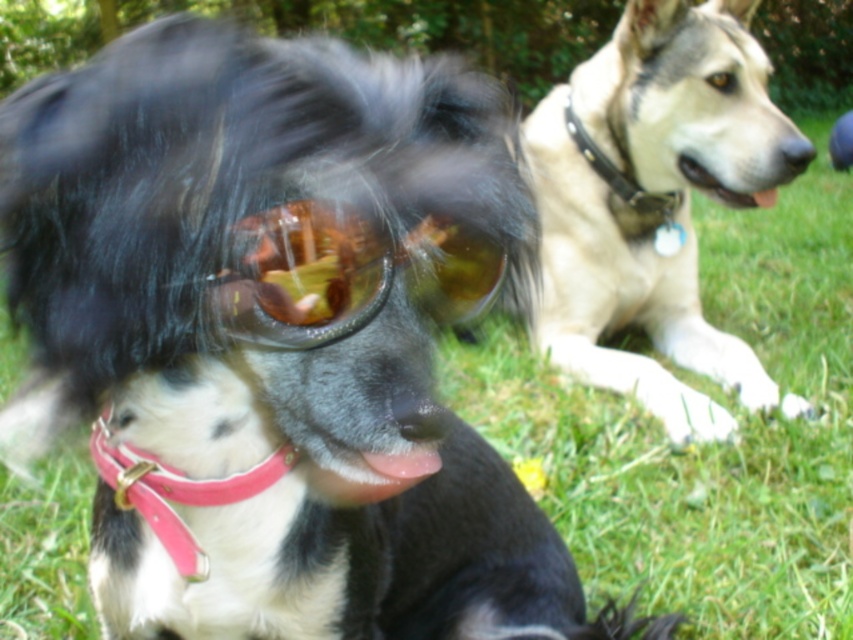
You are a dog owner who wants to put a collar on your dog. You have both the shiny plastic goggles at center and the black leather collar at upper right. Which one is shorter in height and thus more suitable for a dog with a smaller neck?

The shiny plastic goggles at center has a lesser height compared to the black leather collar at upper right, so it is more suitable for a dog with a smaller neck.

You are a dog owner who wants to put a collar on your dog. You have both the shiny plastic goggles at center and the pink leather collar at lower left. Which one is shorter and thus more suitable for a small dog?

The shiny plastic goggles at center is shorter than the pink leather collar at lower left, so it would be more suitable for a small dog.